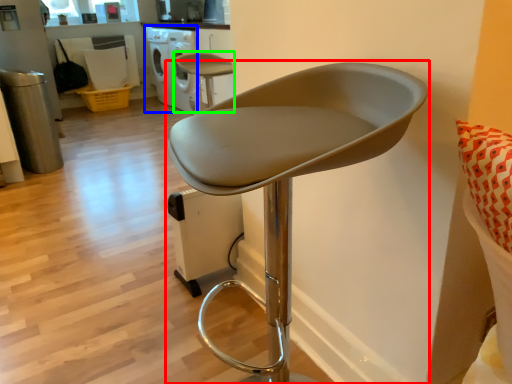
Question: Which object is the farthest from chair (highlighted by a red box)? Choose among these: dish washer (highlighted by a blue box) or chair (highlighted by a green box).

Choices:
 (A) dish washer
 (B) chair

Answer: (A)